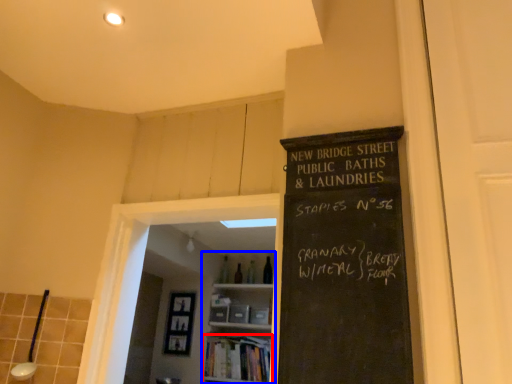
Question: Which object is closer to the camera taking this photo, book (highlighted by a red box) or bookshelf (highlighted by a blue box)?

Choices:
 (A) book
 (B) bookshelf

Answer: (A)